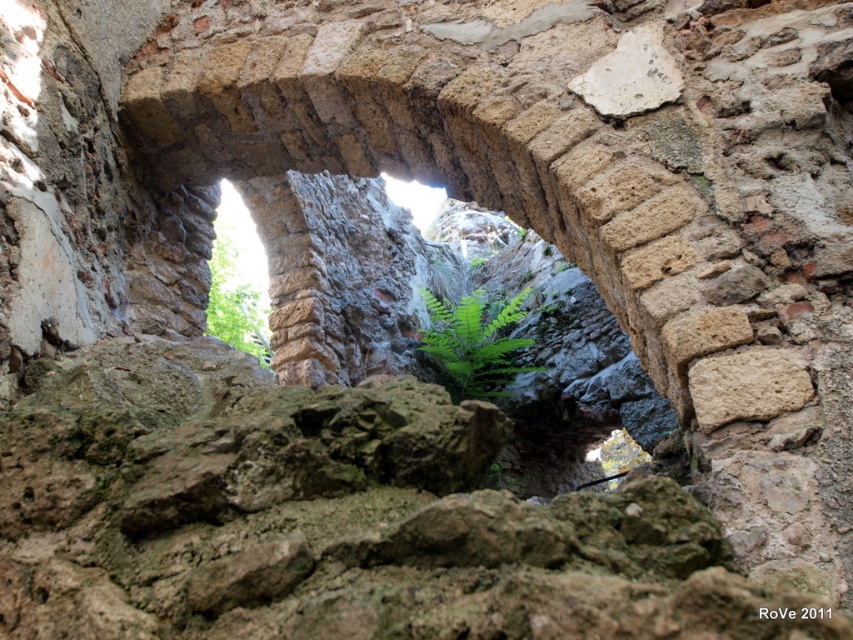
Question: Can you confirm if green leafy fern at center is positioned to the right of green leafy plant at upper left?

Choices:
 (A) yes
 (B) no

Answer: (A)

Question: Is green leafy fern at center further to the viewer compared to green leafy plant at upper left?

Choices:
 (A) no
 (B) yes

Answer: (A)

Question: Where is natural stone archway at center located in relation to green leafy plant at upper left in the image?

Choices:
 (A) left
 (B) right

Answer: (B)

Question: Which point is farther to the camera?

Choices:
 (A) (x=500, y=369)
 (B) (x=235, y=323)
 (C) (x=556, y=420)

Answer: (B)

Question: Estimate the real-world distances between objects in this image. Which object is closer to the natural stone archway at center?

Choices:
 (A) green leafy plant at upper left
 (B) green leafy fern at center

Answer: (B)

Question: Which of the following is the closest to the observer?

Choices:
 (A) natural stone archway at center
 (B) green leafy fern at center

Answer: (A)